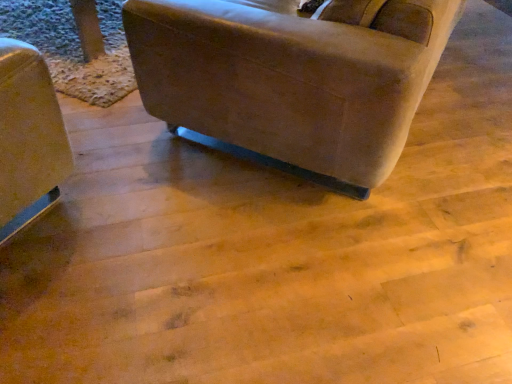
Describe the element at coordinates (292, 79) in the screenshot. I see `suede-like beige chair at center` at that location.

You are a GUI agent. You are given a task and a screenshot of the screen. Output one action in this format:
    pyautogui.click(x=<x>, y=<y>)
    Task: Click on the suede-like beige chair at center
    
    Given the screenshot: What is the action you would take?
    pyautogui.click(x=292, y=79)

Image resolution: width=512 pixels, height=384 pixels. What are the coordinates of `suede-like beige chair at center` in the screenshot? It's located at (292, 79).